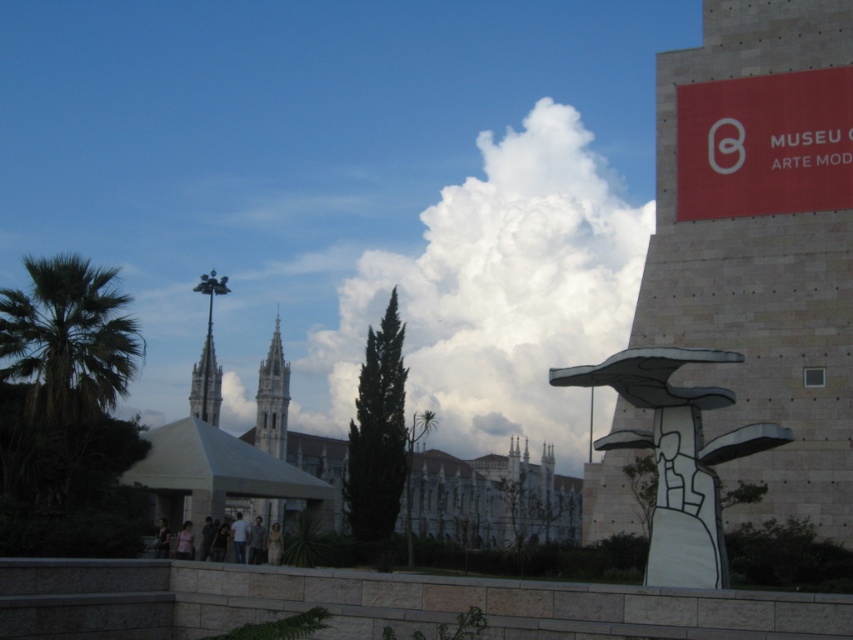
Question: Does beige stone tower at right have a larger size compared to red fabric sign at upper right?

Choices:
 (A) yes
 (B) no

Answer: (A)

Question: Can you confirm if white fluffy cloud at center is positioned above red fabric sign at upper right?

Choices:
 (A) yes
 (B) no

Answer: (B)

Question: Based on their relative distances, which object is farther from the green leafy palm at left?

Choices:
 (A) clear glass spire at upper left
 (B) white fluffy cloud at center
 (C) golden stone tower at center

Answer: (B)

Question: Is green leafy palm at left behind golden stone tower at center?

Choices:
 (A) yes
 (B) no

Answer: (B)

Question: Among these points, which one is farthest from the camera?

Choices:
 (A) (566, 145)
 (B) (51, 337)
 (C) (828, 256)

Answer: (A)

Question: Which object appears closest to the camera in this image?

Choices:
 (A) golden stone tower at center
 (B) clear glass spire at upper left

Answer: (B)